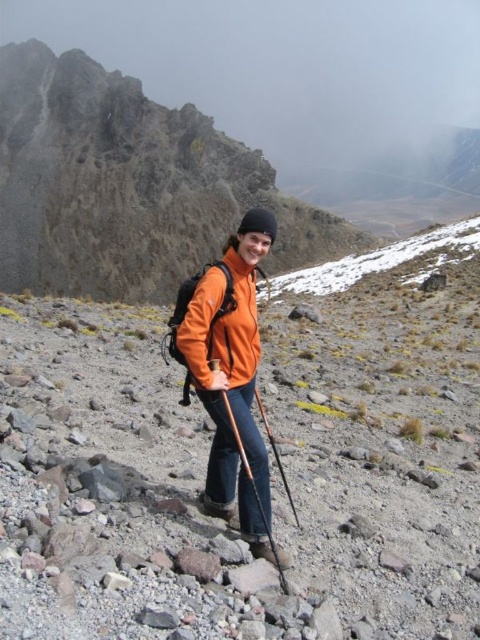
Question: Among these points, which one is farthest from the camera?

Choices:
 (A) (96, 65)
 (B) (285, 474)
 (C) (326, 336)

Answer: (A)

Question: Which point is farther to the camera?

Choices:
 (A) (194, 221)
 (B) (184, 516)
 (C) (192, 308)

Answer: (A)

Question: Does orange matte jacket at center appear under orange fiberglass ski pole at center?

Choices:
 (A) yes
 (B) no

Answer: (B)

Question: Which point is closer to the camera?

Choices:
 (A) brown wood ski pole at center
 (B) orange fabric jacket at center

Answer: (B)

Question: Is brown wood ski pole at center to the left of orange fiberglass ski pole at center from the viewer's perspective?

Choices:
 (A) no
 (B) yes

Answer: (B)

Question: Can you confirm if orange fabric jacket at center is smaller than orange matte jacket at center?

Choices:
 (A) yes
 (B) no

Answer: (B)